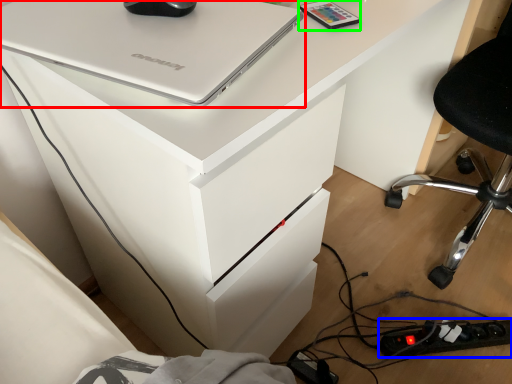
Question: Based on their relative distances, which object is farther from laptop (highlighted by a red box)? Choose from extension cord (highlighted by a blue box) and equipment (highlighted by a green box).

Choices:
 (A) extension cord
 (B) equipment

Answer: (A)